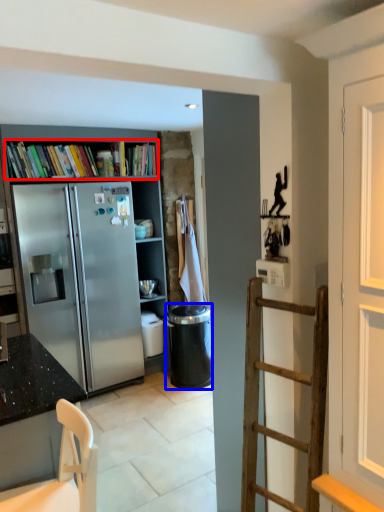
Question: Which of the following is the farthest to the observer, book (highlighted by a red box) or trash bin/can (highlighted by a blue box)?

Choices:
 (A) book
 (B) trash bin/can

Answer: (B)